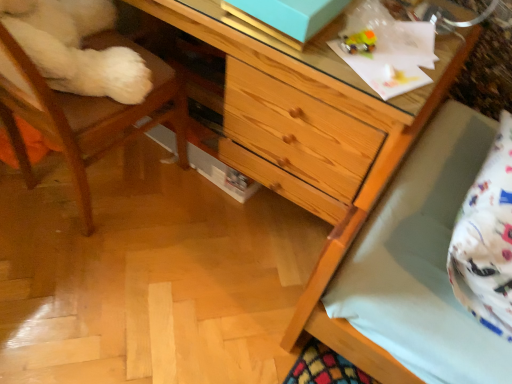
Question: Looking at their shapes, would you say translucent plastic toy at upper right is wider or thinner than wooden chair at left?

Choices:
 (A) wide
 (B) thin

Answer: (B)

Question: Is point (366, 49) closer or farther from the camera than point (29, 66)?

Choices:
 (A) farther
 (B) closer

Answer: (A)

Question: Based on their relative distances, which object is nearer to the wooden chair at left?

Choices:
 (A) wooden chest of drawers at center
 (B) translucent plastic toy at upper right
 (C) white cotton pillow at lower right

Answer: (A)

Question: Which is farther from the wooden chair at left?

Choices:
 (A) wooden chest of drawers at center
 (B) translucent plastic toy at upper right
 (C) white cotton pillow at lower right

Answer: (C)